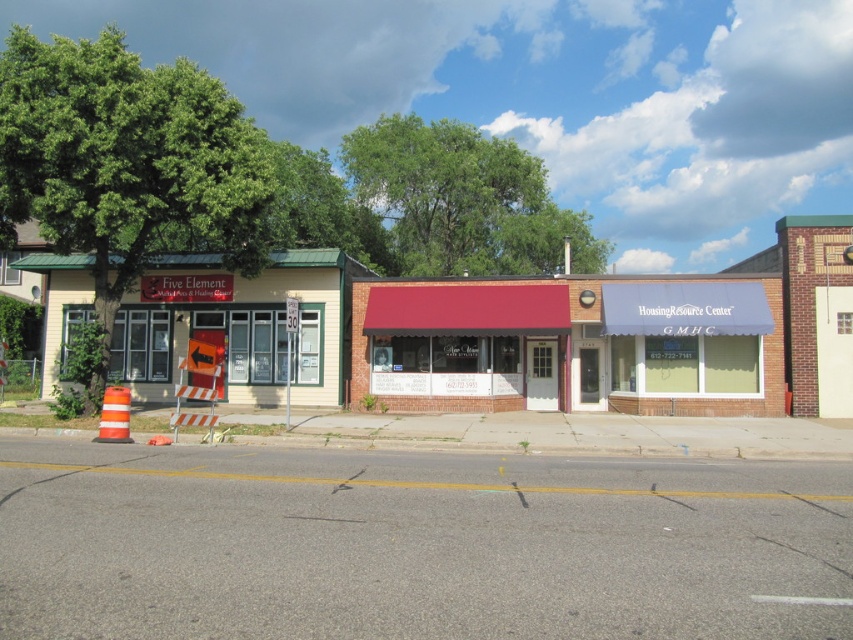
You are a window cleaner standing on the ground between the two storefronts. You need to clean the windows under the maroon fabric awning at center and the yellow siding at left. Which structure will require you to reach higher to clean its windows?

The yellow siding at left requires reaching higher because the maroon fabric awning at center is not as tall as it.

In the scene shown: You are a delivery person trying to park your 2.5 meter wide truck between the maroon fabric awning at center and the yellow siding at left. Based on the scene, can the truck fit between them?

The maroon fabric awning at center occupies less space than yellow siding at left, so the truck can fit between them as there is enough space.

You are a delivery person approaching the two storefronts. You need to deliver a package to the Housing Resource Center. Which side of the yellow siding at left does the maroon fabric awning at center belong to?

The maroon fabric awning at center is positioned on the right side of yellow siding at left, so it belongs to the right side of the yellow siding at left.